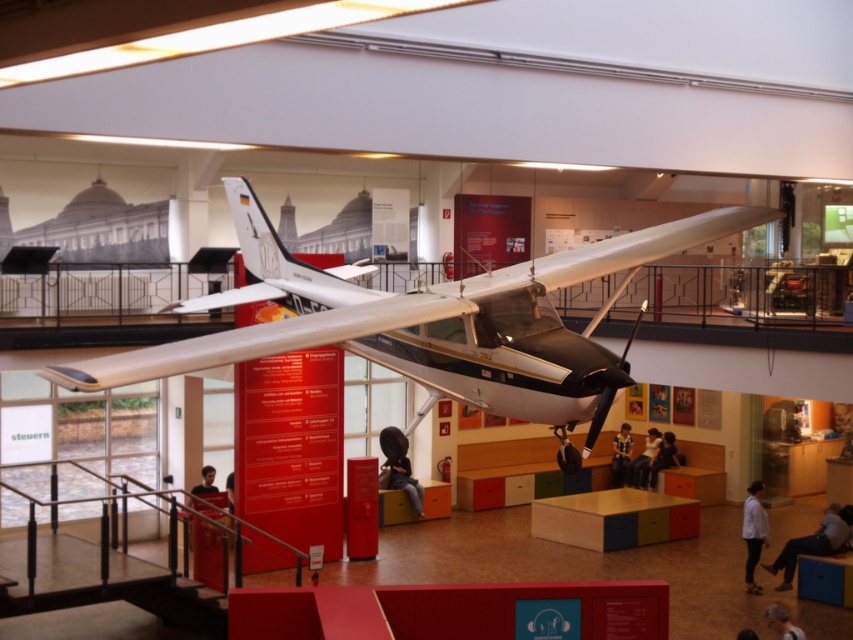
Question: Can you confirm if metallic silver airplane at center is thinner than light brown leather jacket at center?

Choices:
 (A) yes
 (B) no

Answer: (B)

Question: Estimate the real-world distances between objects in this image. Which object is farther from the light brown hair at lower right?

Choices:
 (A) striped shirt at center
 (B) light brown leather jacket at center
 (C) light brown leather shoes at lower right

Answer: (A)

Question: Is metallic silver airplane at center above striped shirt at center?

Choices:
 (A) yes
 (B) no

Answer: (A)

Question: Which is nearer to the metallic silver airplane at center?

Choices:
 (A) white matte shirt at center
 (B) black leather shoe at lower center
 (C) light brown hair at lower right
 (D) dark brown shirt at lower left

Answer: (B)

Question: Which of the following is the farthest from the observer?

Choices:
 (A) [190, 502]
 (B) [640, 486]

Answer: (B)

Question: From the image, what is the correct spatial relationship of dark gray fabric jacket at center in relation to light brown leather jacket at center?

Choices:
 (A) above
 (B) below

Answer: (A)